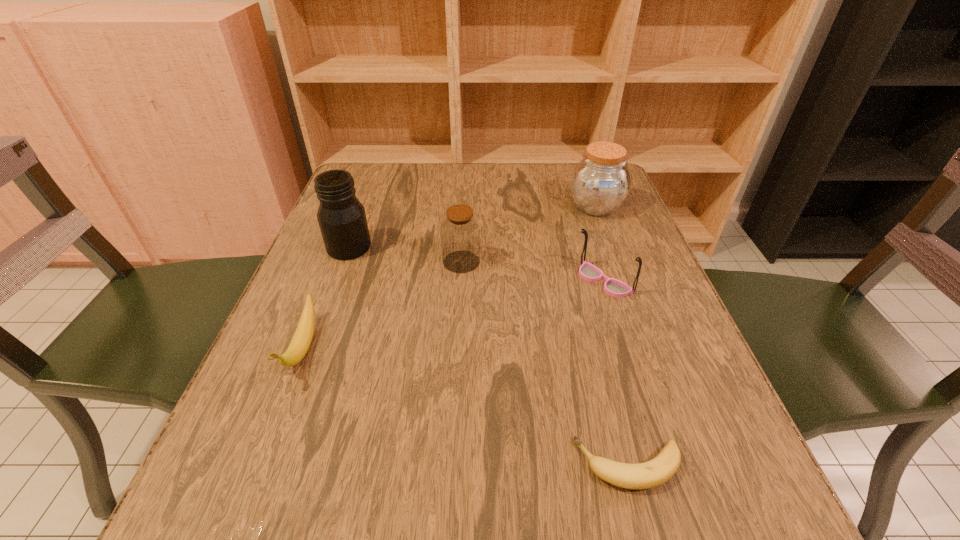
Find the location of `free region located 0.170m on the back of the leftmost jar`. free region located 0.170m on the back of the leftmost jar is located at coordinates (368, 197).

I want to click on vacant space located 0.140m on the front of the farthest jar, so click(614, 259).

This screenshot has height=540, width=960. I want to click on vacant space situated 0.260m on the right of the shortest jar, so click(x=601, y=262).

Where is `vacant space situated on the back of the third shortest object`? The image size is (960, 540). vacant space situated on the back of the third shortest object is located at coordinates (585, 221).

Identify the location of free space located 0.200m at the stem of the second nearest object. The image size is (960, 540). (234, 526).

I want to click on free spot located at the stem of the nearest object, so click(x=512, y=465).

This screenshot has width=960, height=540. I want to click on vacant space located 0.050m at the stem of the nearest object, so click(540, 465).

Identify the location of vacant space located 0.370m at the stem of the nearest object. The width and height of the screenshot is (960, 540). (310, 465).

The width and height of the screenshot is (960, 540). What are the coordinates of `object located in the far edge section of the desktop` in the screenshot? It's located at (601, 181).

At what (x,y) coordinates should I click in order to perform the action: click on object located in the near edge section of the desktop. Please return your answer as a coordinate pair (x, y). Looking at the image, I should click on (657, 471).